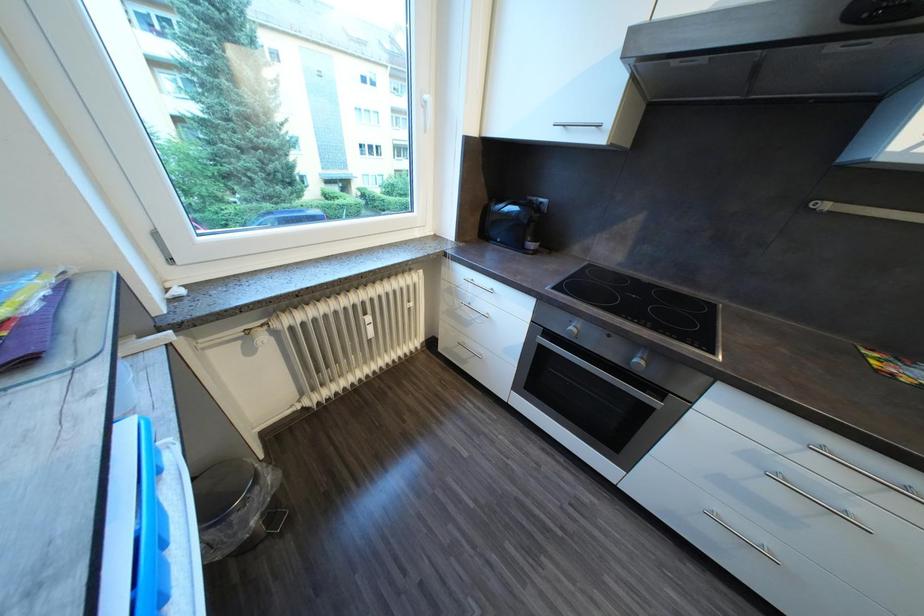
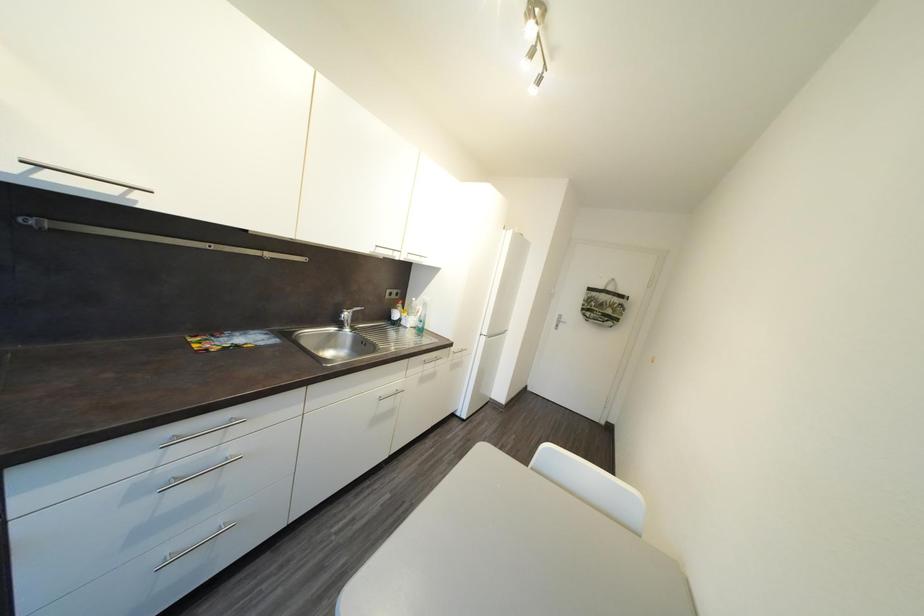
The images are taken continuously from a first-person perspective. In which direction is your viewpoint rotating?

The camera's rotation is toward right-down.